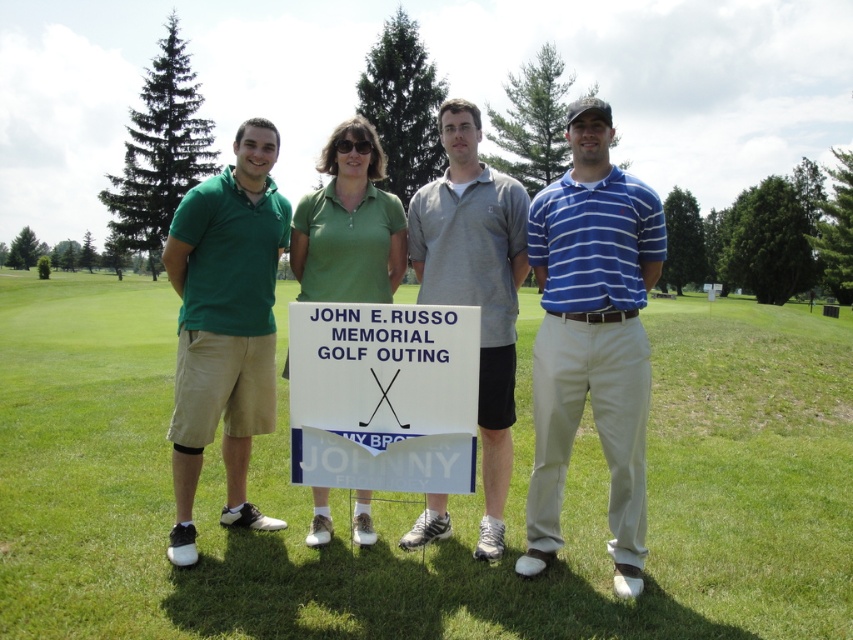
Question: Is blue striped polo shirt at center smaller than green matte shirt at center?

Choices:
 (A) no
 (B) yes

Answer: (A)

Question: Can you confirm if white paper sign at center is wider than gray cotton polo shirt at center?

Choices:
 (A) yes
 (B) no

Answer: (A)

Question: Estimate the real-world distances between objects in this image. Which object is farther from the green matte shirt at center?

Choices:
 (A) green cotton polo shirt at left
 (B) green grass at center
 (C) blue striped polo shirt at center

Answer: (B)

Question: Which object appears farthest from the camera in this image?

Choices:
 (A) blue striped polo shirt at center
 (B) green cotton polo shirt at left
 (C) green matte shirt at center
 (D) green grass at center

Answer: (C)

Question: Can you confirm if blue striped polo shirt at center is positioned to the left of green cotton polo shirt at left?

Choices:
 (A) no
 (B) yes

Answer: (A)

Question: Which point appears closest to the camera in this image?

Choices:
 (A) (498, 525)
 (B) (581, 385)

Answer: (B)